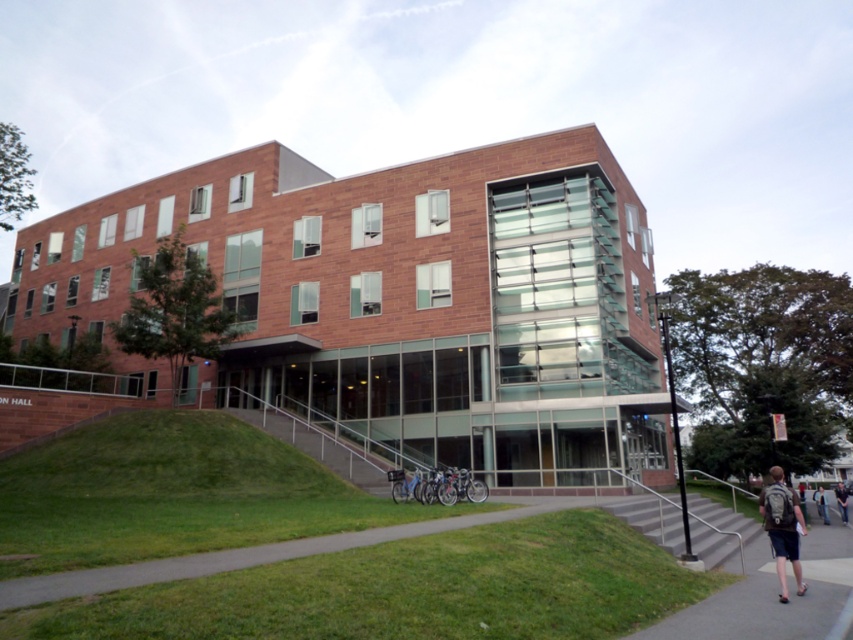
You are standing in front of the modern brick building and see a gray backpack at lower right and dark blue jeans at lower right. Which object is closer to you?

The gray backpack at lower right is closer to you because it is in front of the dark blue jeans at lower right.

You are standing at the base of the stairs leading to the modern brick building. You notice a gray backpack at lower right and dark blue jeans at lower right. Which item is closer to you?

The gray backpack at lower right is 43.54 feet away from dark blue jeans at lower right. Since the distance between them is fixed, both items are at the same distance from you unless their positions relative to your location change. However, without additional information about their exact placement along the slope or their positions relative to each other, it is impossible to determine which is closer based solely on the provided description.

You are standing on the grassy area in front of the modern brick building. You see the metallic gray staircase at lower right and the dark blue jeans at lower right. Which object is closer to you?

The metallic gray staircase at lower right is closer to you because it is in front of the dark blue jeans at lower right.